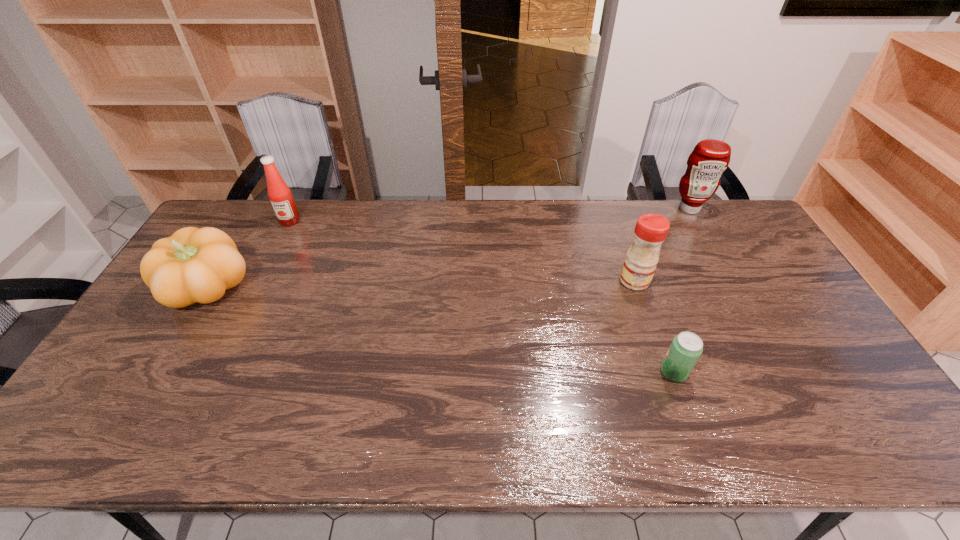
Locate an element on the screen. This screenshot has width=960, height=540. condiment that is the second closest to the rightmost condiment is located at coordinates (286, 212).

Identify which condiment is located as the second nearest to the second shortest object. Please provide its 2D coordinates. Your answer should be formatted as a tuple, i.e. [(x, y)], where the tuple contains the x and y coordinates of a point satisfying the conditions above.

[(641, 259)]

Locate an element on the screen. free space that satisfies the following two spatial constraints: 1. on the back side of the rightmost object; 2. on the left side of the pumpkin is located at coordinates (257, 208).

This screenshot has height=540, width=960. Identify the location of free region that satisfies the following two spatial constraints: 1. on the back side of the fourth tallest object; 2. on the left side of the rightmost condiment. (257, 208).